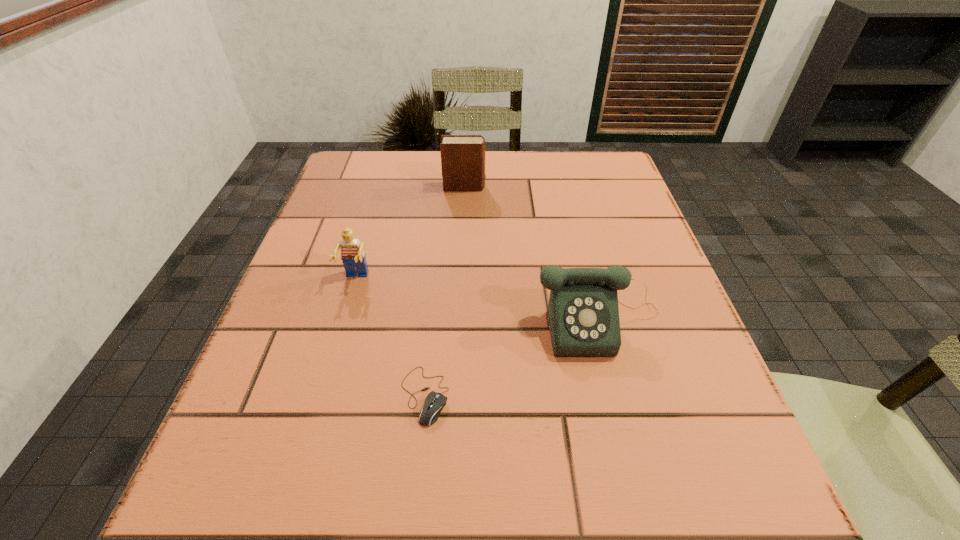
Find the location of a particular element. The image size is (960, 540). free space that is in between the diary and the leftmost object is located at coordinates (410, 233).

Select which object is the second closest to the nearest object. Please provide its 2D coordinates. Your answer should be formatted as a tuple, i.e. [(x, y)], where the tuple contains the x and y coordinates of a point satisfying the conditions above.

[(353, 257)]

Locate an element on the screen. object that stands as the second closest to the farthest object is located at coordinates (583, 313).

The height and width of the screenshot is (540, 960). In order to click on free space that satisfies the following two spatial constraints: 1. on the face of the Lego; 2. on the left side of the nearest object in this screenshot , I will do `click(323, 395)`.

At what (x,y) coordinates should I click in order to perform the action: click on free space that satisfies the following two spatial constraints: 1. on the spine side of the diary; 2. on the face of the leftmost object. Please return your answer as a coordinate pair (x, y). This screenshot has width=960, height=540. Looking at the image, I should click on (461, 279).

What are the coordinates of `free space in the image that satisfies the following two spatial constraints: 1. on the spine side of the farthest object; 2. on the face of the second farthest object` in the screenshot? It's located at (461, 279).

Locate an element on the screen. blank area in the image that satisfies the following two spatial constraints: 1. on the face of the third nearest object; 2. on the left side of the nearest object is located at coordinates (323, 395).